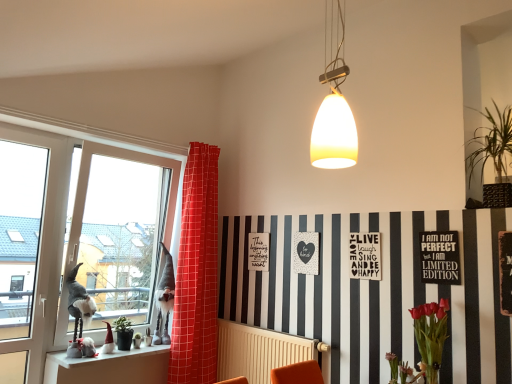
Question: Is transparent glass window at left facing towards green matte plant at lower left, which ranks as the first plant in bottom-to-top order?

Choices:
 (A) no
 (B) yes

Answer: (B)

Question: Would you say transparent glass window at left is outside green matte plant at lower left, arranged as the 1th plant when viewed from the left?

Choices:
 (A) no
 (B) yes

Answer: (B)

Question: From the image's perspective, is transparent glass window at left under green matte plant at lower left, arranged as the 1th plant when viewed from the left?

Choices:
 (A) no
 (B) yes

Answer: (A)

Question: Considering the relative positions of transparent glass window at left and green matte plant at lower left, the 2th plant positioned from the top, in the image provided, is transparent glass window at left to the left of green matte plant at lower left, the 2th plant positioned from the top, from the viewer's perspective?

Choices:
 (A) no
 (B) yes

Answer: (B)

Question: Considering the relative sizes of transparent glass window at left and green matte plant at lower left, arranged as the 1th plant when viewed from the left, in the image provided, is transparent glass window at left shorter than green matte plant at lower left, arranged as the 1th plant when viewed from the left,?

Choices:
 (A) yes
 (B) no

Answer: (B)

Question: Is beige radiator at lower center bigger or smaller than white matte postcard at center, placed as the second postcard when sorted from front to back?

Choices:
 (A) small
 (B) big

Answer: (B)

Question: Is beige radiator at lower center taller or shorter than white matte postcard at center, which ranks as the 1th postcard in back-to-front order?

Choices:
 (A) tall
 (B) short

Answer: (A)

Question: From the image's perspective, is beige radiator at lower center above or below white matte postcard at center, the first postcard when ordered from left to right?

Choices:
 (A) below
 (B) above

Answer: (A)

Question: In the image, is beige radiator at lower center positioned in front of or behind white matte postcard at center, the first postcard when ordered from left to right?

Choices:
 (A) behind
 (B) front

Answer: (B)

Question: Considering the positions of white ceramic gnomes at lower left and beige radiator at lower center in the image, is white ceramic gnomes at lower left taller or shorter than beige radiator at lower center?

Choices:
 (A) short
 (B) tall

Answer: (A)

Question: Visually, is white ceramic gnomes at lower left positioned to the left or to the right of beige radiator at lower center?

Choices:
 (A) right
 (B) left

Answer: (B)

Question: Based on their sizes in the image, would you say white ceramic gnomes at lower left is bigger or smaller than beige radiator at lower center?

Choices:
 (A) big
 (B) small

Answer: (B)

Question: From a real-world perspective, is white ceramic gnomes at lower left above or below beige radiator at lower center?

Choices:
 (A) below
 (B) above

Answer: (B)

Question: Considering the positions of green matte plant at lower left, the second plant from the right, and beige radiator at lower center in the image, is green matte plant at lower left, the second plant from the right, wider or thinner than beige radiator at lower center?

Choices:
 (A) wide
 (B) thin

Answer: (A)

Question: Does point (120, 322) appear closer or farther from the camera than point (280, 360)?

Choices:
 (A) farther
 (B) closer

Answer: (A)